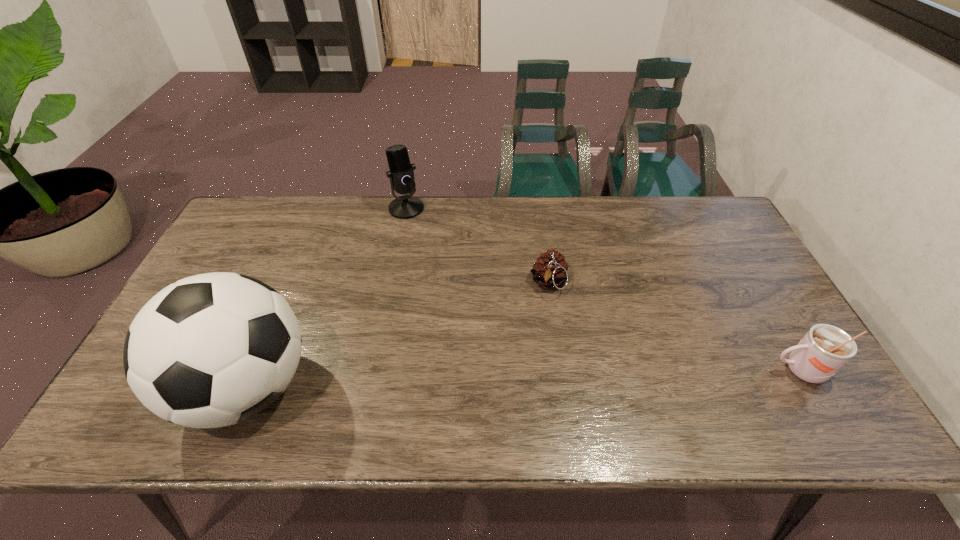
Find the location of `cup that is at the near edge`. cup that is at the near edge is located at coordinates (824, 349).

In order to click on object present at the left edge in this screenshot , I will do tap(211, 350).

At what (x,y) coordinates should I click in order to perform the action: click on object located in the right edge section of the desktop. Please return your answer as a coordinate pair (x, y). Looking at the image, I should click on (824, 349).

Locate an element on the screen. Image resolution: width=960 pixels, height=540 pixels. object that is positioned at the near left corner is located at coordinates (211, 350).

At what (x,y) coordinates should I click in order to perform the action: click on object located at the near right corner. Please return your answer as a coordinate pair (x, y). This screenshot has width=960, height=540. Looking at the image, I should click on (824, 349).

You are a GUI agent. You are given a task and a screenshot of the screen. Output one action in this format:
    pyautogui.click(x=<x>, y=<y>)
    Task: Click on the vacant space at the far edge of the desktop
    
    Given the screenshot: What is the action you would take?
    pyautogui.click(x=329, y=197)

The image size is (960, 540). What are the coordinates of `blank space at the near edge` in the screenshot? It's located at (755, 389).

Where is `vacant region at the right edge`? This screenshot has height=540, width=960. vacant region at the right edge is located at coordinates (739, 296).

Find the location of a particular element. The image size is (960, 540). vacant space that is in between the cup and the shortest object is located at coordinates (674, 327).

Find the location of a particular element. This screenshot has width=960, height=540. vacant space in between the shortest object and the tallest object is located at coordinates (398, 335).